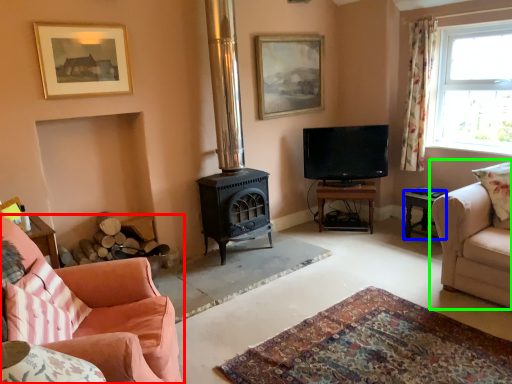
Question: Which object is the farthest from studio couch (highlighted by a red box)? Choose among these: table (highlighted by a blue box) or studio couch (highlighted by a green box).

Choices:
 (A) table
 (B) studio couch

Answer: (A)